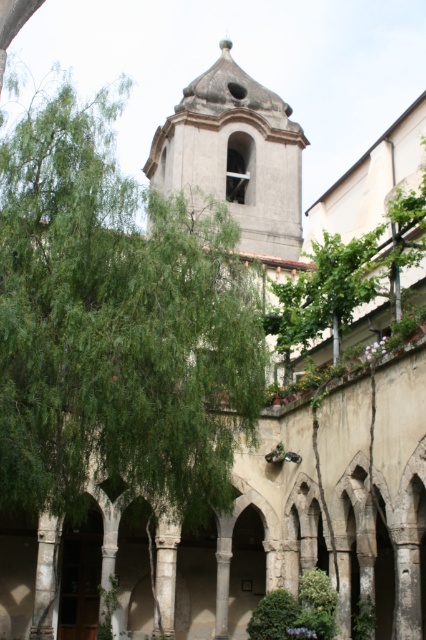
Between green leafy tree at center and gray stone bell tower at center, which one appears on the right side from the viewer's perspective?

gray stone bell tower at center is more to the right.

Who is shorter, green leafy tree at center or gray stone bell tower at center?

With less height is green leafy tree at center.

Is point (57, 426) farther from camera compared to point (276, 157)?

No, (57, 426) is in front of (276, 157).

You are a GUI agent. You are given a task and a screenshot of the screen. Output one action in this format:
    pyautogui.click(x=<x>, y=<y>)
    Task: Click on the green leafy tree at center
    
    Given the screenshot: What is the action you would take?
    pyautogui.click(x=115, y=326)